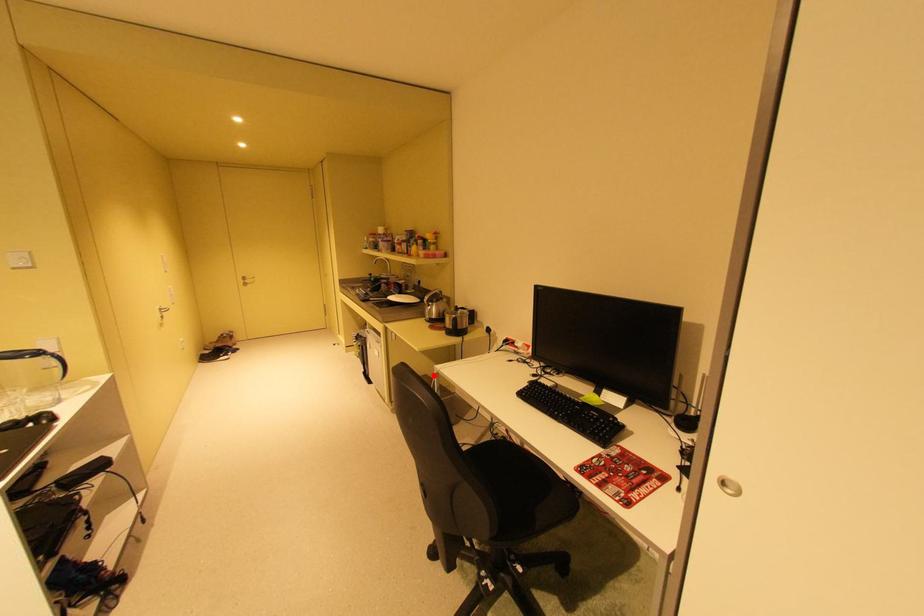
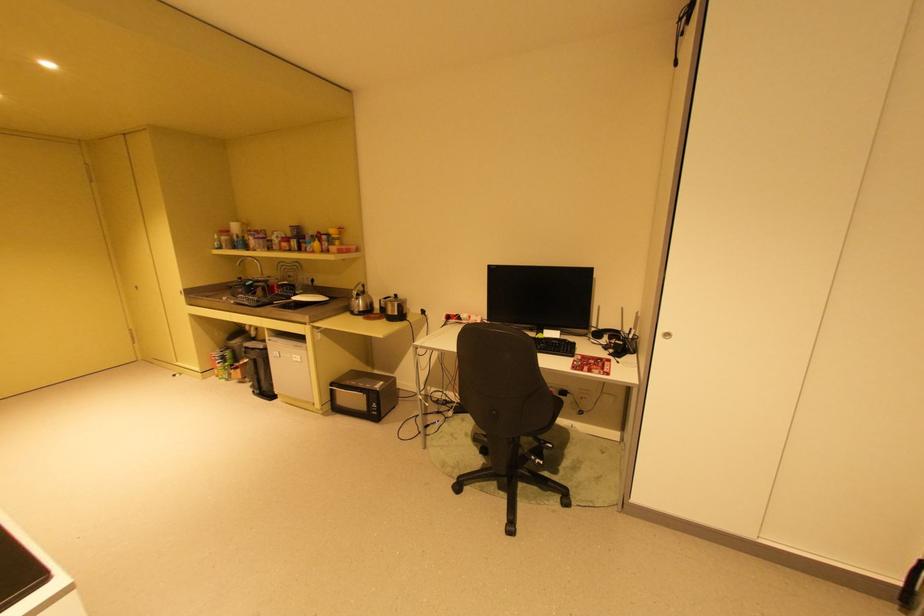
Question: A red point is marked in image1. In image2, is the corresponding 3D point closer to the camera or farther? Reply with the corresponding letter.

Choices:
 (A) The corresponding 3D point is closer.
 (B) The corresponding 3D point is farther.

Answer: (A)